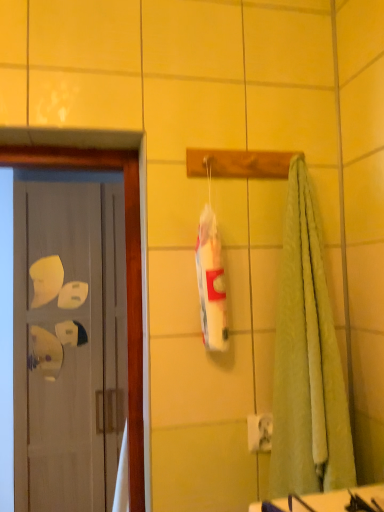
Question: In terms of width, does white glossy counter top at lower right look wider or thinner when compared to white glossy door at left?

Choices:
 (A) wide
 (B) thin

Answer: (B)

Question: Visually, is white glossy counter top at lower right positioned to the left or to the right of white glossy door at left?

Choices:
 (A) left
 (B) right

Answer: (B)

Question: Which is correct: white glossy counter top at lower right is inside white glossy door at left, or outside of it?

Choices:
 (A) inside
 (B) outside

Answer: (B)

Question: From a real-world perspective, is white glossy door at left above or below white glossy counter top at lower right?

Choices:
 (A) above
 (B) below

Answer: (B)

Question: Is white glossy door at left inside the boundaries of white glossy counter top at lower right, or outside?

Choices:
 (A) outside
 (B) inside

Answer: (A)

Question: In terms of width, does white glossy door at left look wider or thinner when compared to white glossy counter top at lower right?

Choices:
 (A) wide
 (B) thin

Answer: (A)

Question: From the image's perspective, is white glossy door at left above or below white glossy counter top at lower right?

Choices:
 (A) above
 (B) below

Answer: (B)